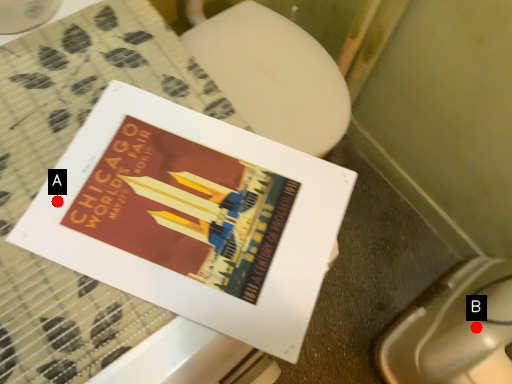
Question: Two points are circled on the image, labeled by A and B beside each circle. Which of the following is the closest to the observer?

Choices:
 (A) A is closer
 (B) B is closer

Answer: (A)